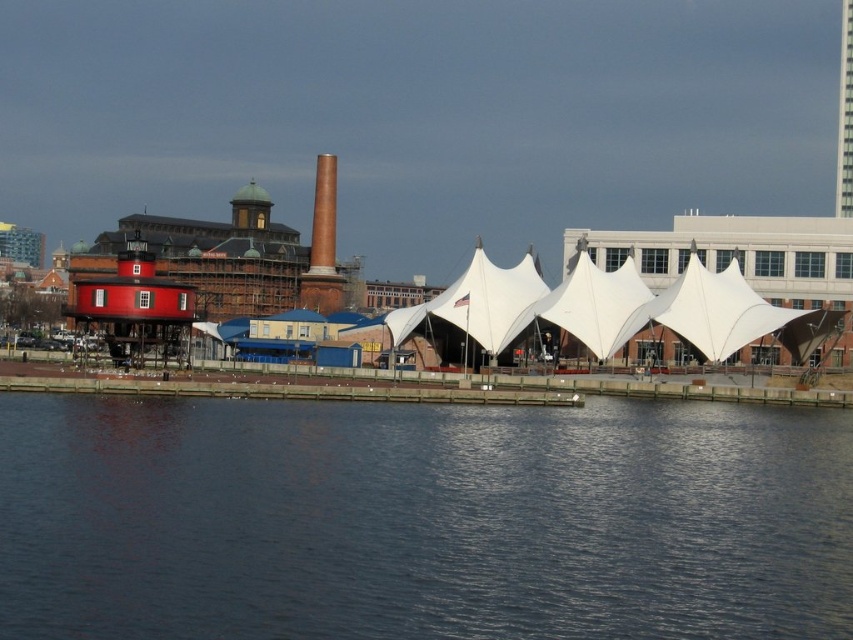
Question: Is white fabric tent at center positioned in front of white fabric canopy at center?

Choices:
 (A) no
 (B) yes

Answer: (A)

Question: Which point appears farthest from the camera in this image?

Choices:
 (A) (711, 280)
 (B) (303, 460)

Answer: (A)

Question: Is white fabric tent at center smaller than white fabric canopy at center?

Choices:
 (A) yes
 (B) no

Answer: (B)

Question: Does dark blue water at lower center appear under white fabric tent at center?

Choices:
 (A) yes
 (B) no

Answer: (A)

Question: Estimate the real-world distances between objects in this image. Which object is farther from the white fabric canopy at center?

Choices:
 (A) white fabric tent at center
 (B) dark blue water at lower center

Answer: (B)

Question: Among these objects, which one is nearest to the camera?

Choices:
 (A) dark blue water at lower center
 (B) white fabric canopy at center

Answer: (A)